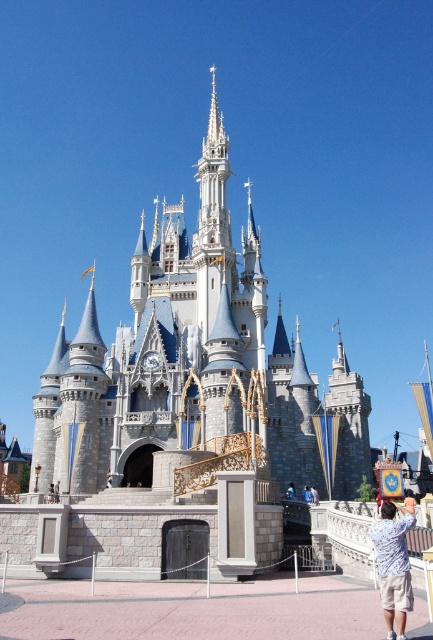
Does gray stone castle at center have a lesser width compared to light blue shirt at lower right?

No, gray stone castle at center is not thinner than light blue shirt at lower right.

Is gray stone castle at center above light blue shirt at lower right?

Yes, gray stone castle at center is above light blue shirt at lower right.

Is point (230, 257) behind point (409, 600)?

Yes, it is.

Locate an element on the screen. The image size is (433, 640). gray stone castle at center is located at coordinates (194, 365).